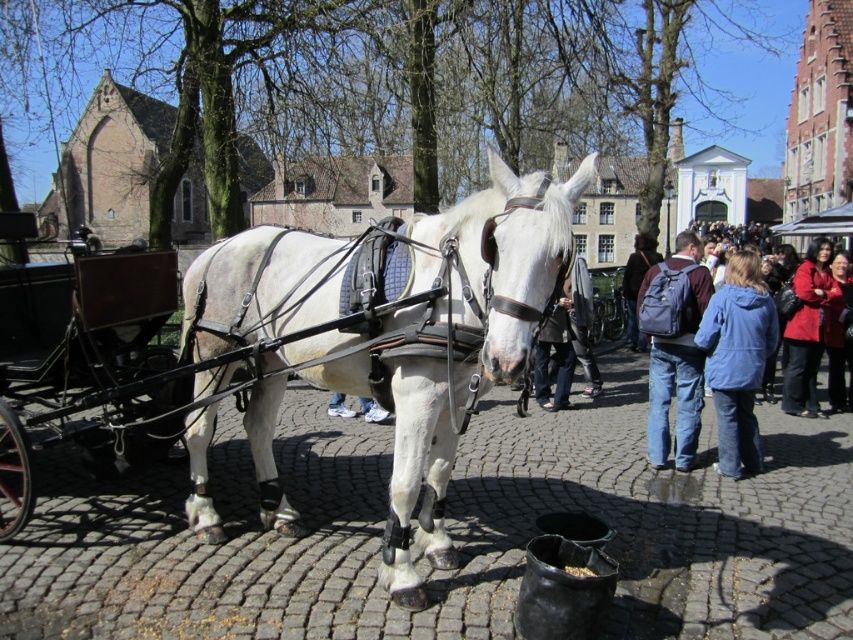
You are a tourist in the town square and want to take a photo of the wooden cart at left and the red leather jacket at lower right. To ensure both are in the frame, which object should you position closer to the camera?

You should position the wooden cart at left closer to the camera because it is in front of the red leather jacket at lower right, so adjusting its position will help both objects fit into the frame.